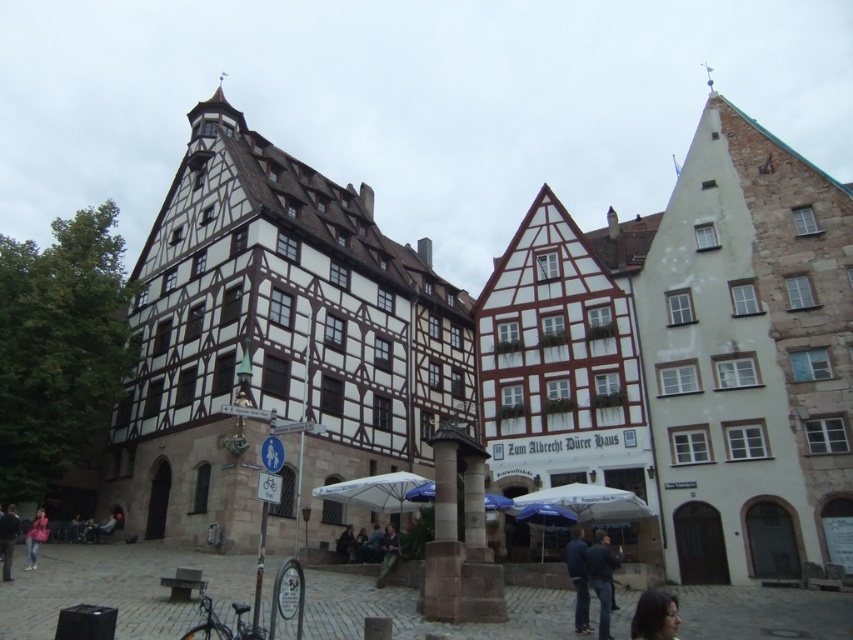
Does leather jacket at lower left lie in front of dark blue jeans at center?

Yes, leather jacket at lower left is in front of dark blue jeans at center.

I want to click on leather jacket at lower left, so click(x=35, y=538).

In the scene shown: Does smooth brown hair at lower right appear under dark blue jeans at lower left?

Indeed, smooth brown hair at lower right is positioned under dark blue jeans at lower left.

Between smooth brown hair at lower right and dark blue jeans at lower left, which one appears on the left side from the viewer's perspective?

dark blue jeans at lower left is more to the left.

The height and width of the screenshot is (640, 853). What are the coordinates of `smooth brown hair at lower right` in the screenshot? It's located at [x=654, y=616].

Find the location of `smooth brown hair at lower right`. smooth brown hair at lower right is located at coordinates (654, 616).

Who is positioned more to the left, dark blue jeans at lower left or dark blue jeans at center?

dark blue jeans at lower left

Who is more forward, (16,525) or (343,531)?

Point (16,525) is more forward.

At what (x,y) coordinates should I click in order to perform the action: click on dark blue jeans at lower left. Please return your answer as a coordinate pair (x, y). The width and height of the screenshot is (853, 640). Looking at the image, I should click on (7, 540).